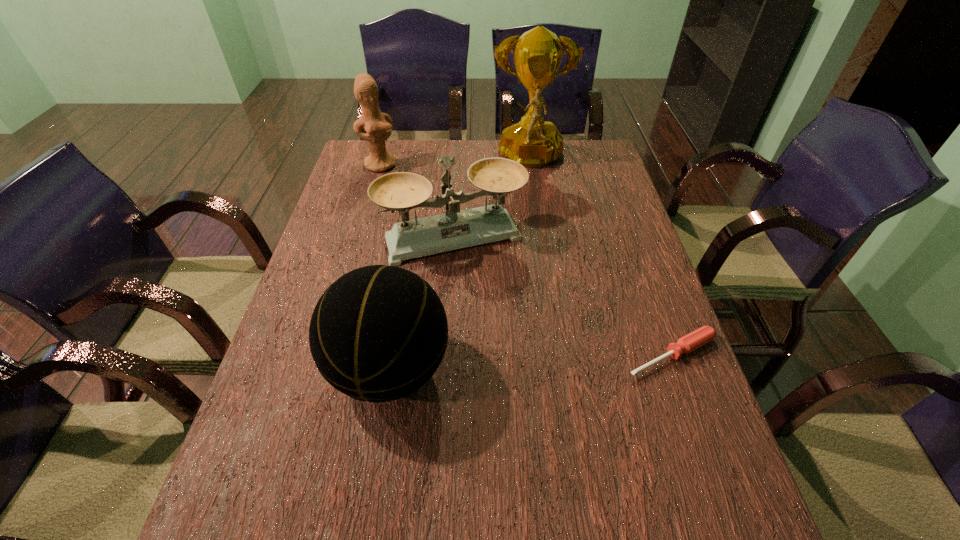
At what (x,y) coordinates should I click in order to perform the action: click on vacant space located on the front side of the tallest object. Please return your answer as a coordinate pair (x, y). The height and width of the screenshot is (540, 960). Looking at the image, I should click on (532, 196).

Find the location of a particular element. free space located on the front-facing side of the third nearest object is located at coordinates pyautogui.click(x=530, y=395).

Locate an element on the screen. vacant region located on the front-facing side of the third nearest object is located at coordinates (524, 383).

Locate an element on the screen. The height and width of the screenshot is (540, 960). free location located on the front-facing side of the third nearest object is located at coordinates (501, 329).

I want to click on free space located on the front-facing side of the figurine, so tap(395, 180).

Identify the location of vacant position located 0.380m on the front-facing side of the figurine. (443, 235).

This screenshot has height=540, width=960. What are the coordinates of `blank space located on the front-facing side of the figurine` in the screenshot? It's located at (422, 212).

The height and width of the screenshot is (540, 960). I want to click on award at the far edge, so click(532, 142).

In order to click on figurine that is at the far edge in this screenshot , I will do `click(377, 125)`.

I want to click on basketball that is at the left edge, so click(x=378, y=333).